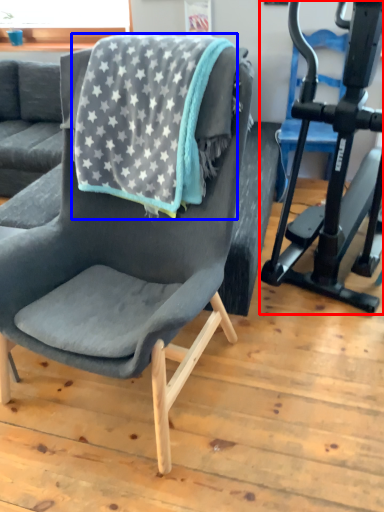
Question: Which object is further to the camera taking this photo, stationary bicycle (highlighted by a red box) or beach towel (highlighted by a blue box)?

Choices:
 (A) stationary bicycle
 (B) beach towel

Answer: (B)